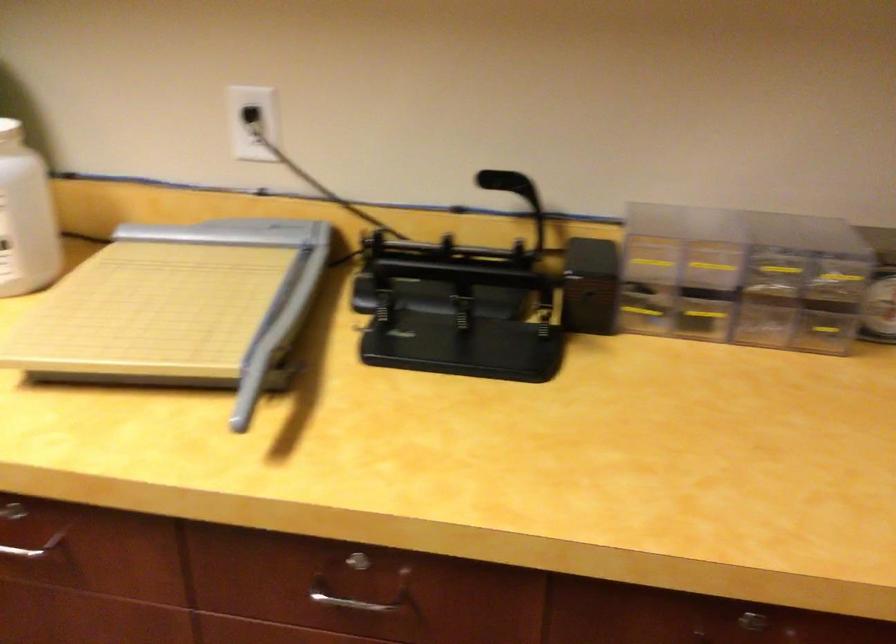
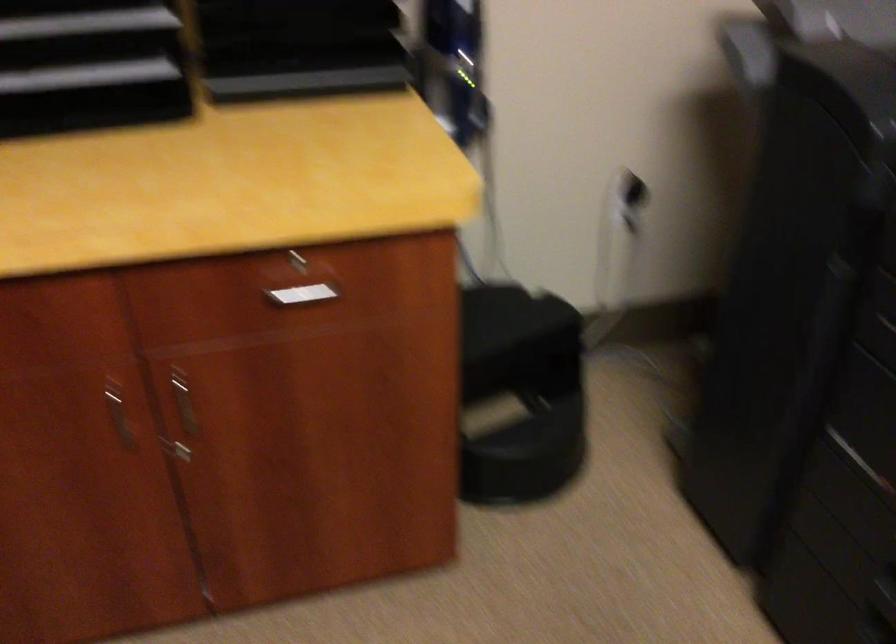
The first image is from the beginning of the video and the second image is from the end. How did the camera likely rotate when shooting the video?

The rotation direction of the camera is right-down.